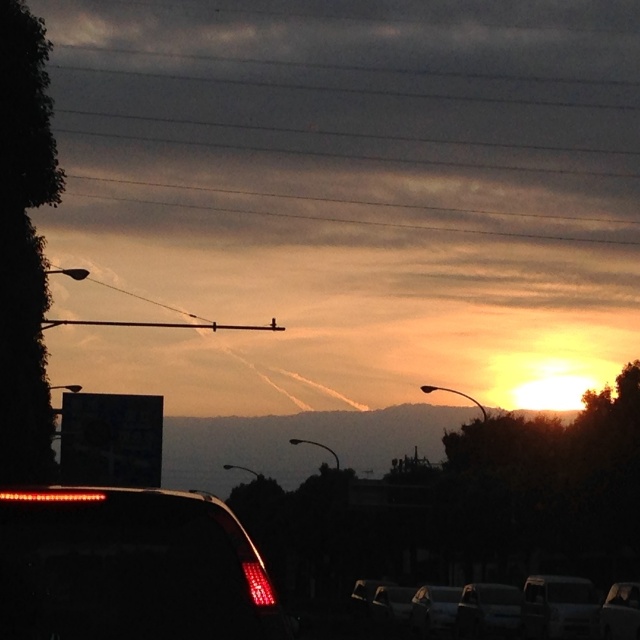
Describe the element at coordinates (129, 566) in the screenshot. Image resolution: width=640 pixels, height=640 pixels. I see `matte red tail light at lower left` at that location.

Which is more to the right, matte red tail light at lower left or metallic silver sedan at center?

metallic silver sedan at center is more to the right.

Find the location of a particular element. matte red tail light at lower left is located at coordinates (129, 566).

Can you confirm if metallic silver sedan at center is taller than metallic silver car at center?

No.

Who is more forward, (428,592) or (364,609)?

Point (428,592) is in front.

Where is `metallic silver sedan at center`? This screenshot has height=640, width=640. metallic silver sedan at center is located at coordinates (433, 608).

Can you confirm if shiny black car at lower center is shorter than metallic silver car at center?

Yes.

Can you confirm if shiny black car at lower center is wider than metallic silver car at center?

In fact, shiny black car at lower center might be narrower than metallic silver car at center.

Is point (397, 616) positioned behind point (388, 584)?

No, (397, 616) is in front of (388, 584).

I want to click on shiny black car at lower center, so click(392, 604).